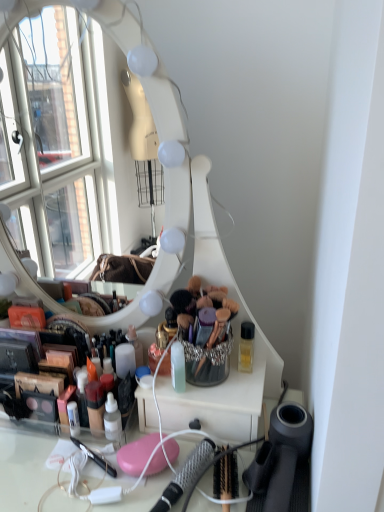
Question: Would you say metallic silver hairbrush at lower center is inside or outside shiny plastic makeup at center?

Choices:
 (A) inside
 (B) outside

Answer: (B)

Question: Based on their sizes in the image, would you say metallic silver hairbrush at lower center is bigger or smaller than shiny plastic makeup at center?

Choices:
 (A) big
 (B) small

Answer: (B)

Question: In the image, is metallic silver hairbrush at lower center on the left side or the right side of shiny plastic makeup at center?

Choices:
 (A) left
 (B) right

Answer: (B)

Question: From the image's perspective, is shiny plastic makeup at center above or below metallic silver hairbrush at lower center?

Choices:
 (A) above
 (B) below

Answer: (A)

Question: Is shiny plastic makeup at center taller or shorter than metallic silver hairbrush at lower center?

Choices:
 (A) tall
 (B) short

Answer: (A)

Question: Choose the correct answer: Is shiny plastic makeup at center inside metallic silver hairbrush at lower center or outside it?

Choices:
 (A) inside
 (B) outside

Answer: (B)

Question: From a real-world perspective, relative to metallic silver hairbrush at lower center, is shiny plastic makeup at center vertically above or below?

Choices:
 (A) below
 (B) above

Answer: (B)